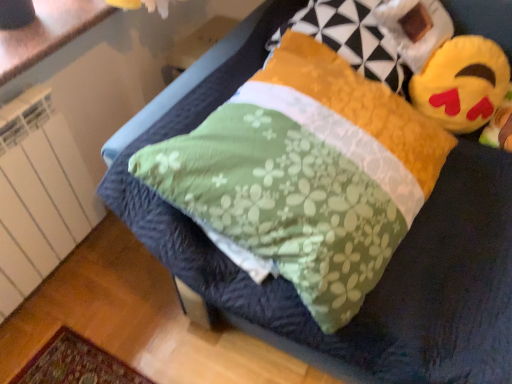
Locate an element on the screen. This screenshot has width=512, height=384. vacant region above white glossy countertop at upper left (from a real-world perspective) is located at coordinates (39, 29).